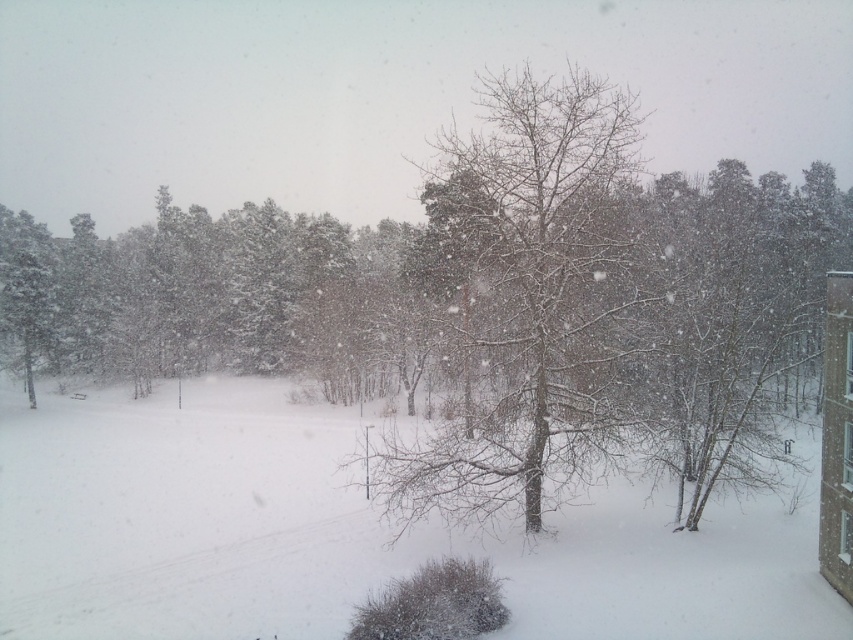
In the scene shown: You are standing in a room with two windows at the upper right corner. You notice the transparent glass window at upper right and the clear glass window at upper right. Which window is taller?

The clear glass window at upper right is taller than the transparent glass window at upper right according to the description.

You are standing on a balcony looking at the winter scene. You want to take a photo where the white fluffy snow at center is exactly at the center of the photo. Is the snow already positioned correctly?

The white fluffy snow at center is located at point (346,532) in the image, which is not the exact center. To center it, you would need to adjust your camera angle so that the snow is at the middle point of the image.